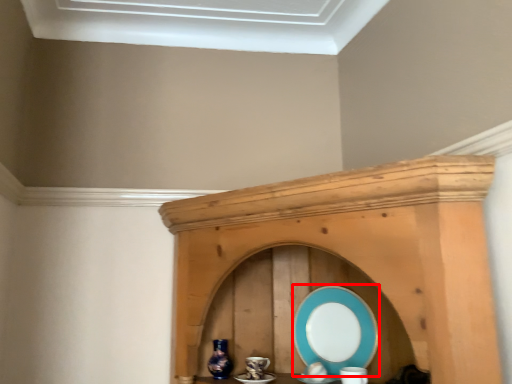
Question: Considering the relative positions of platter (annotated by the red box) and vase in the image provided, where is platter (annotated by the red box) located with respect to the staircase?

Choices:
 (A) left
 (B) right

Answer: (B)